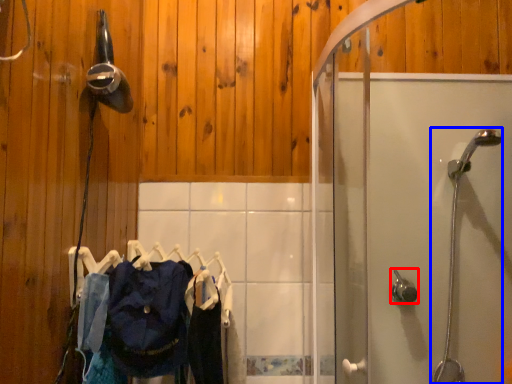
Question: Which point is further to the camera, shower (highlighted by a red box) or shower (highlighted by a blue box)?

Choices:
 (A) shower
 (B) shower

Answer: (A)